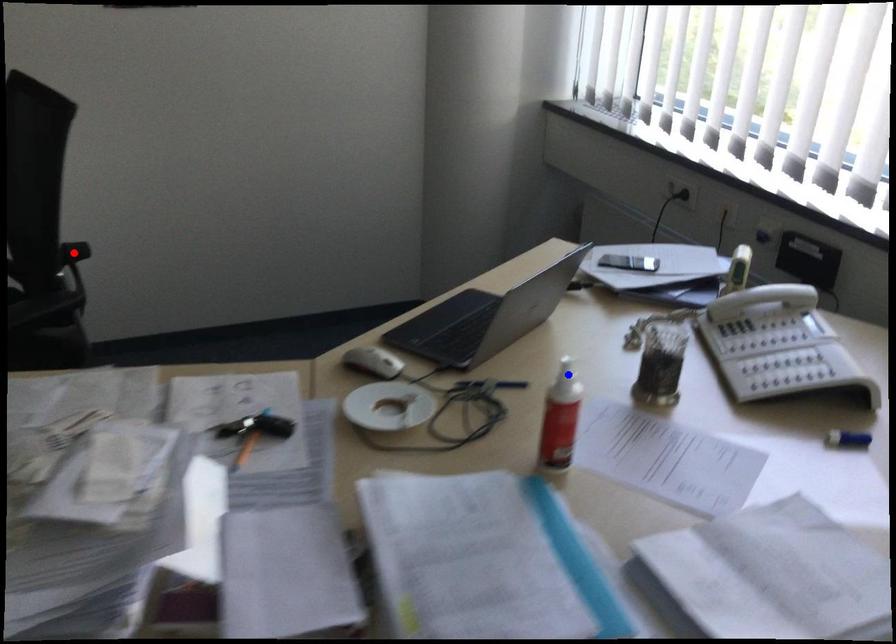
Question: Two points are marked on the image. Which point is closer to the camera?

Choices:
 (A) Blue point is closer.
 (B) Red point is closer.

Answer: (A)